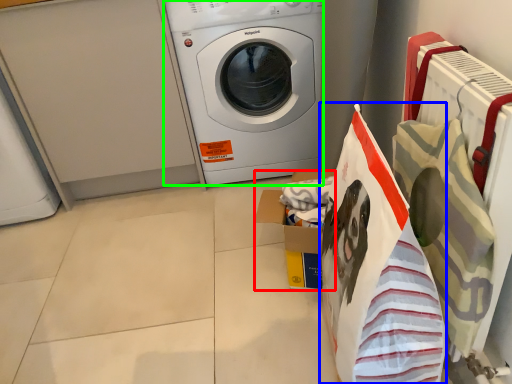
Question: Which is farther away from cardboard box (highlighted by a red box)? shopping bag (highlighted by a blue box) or washing machine (highlighted by a green box)?

Choices:
 (A) shopping bag
 (B) washing machine

Answer: (B)